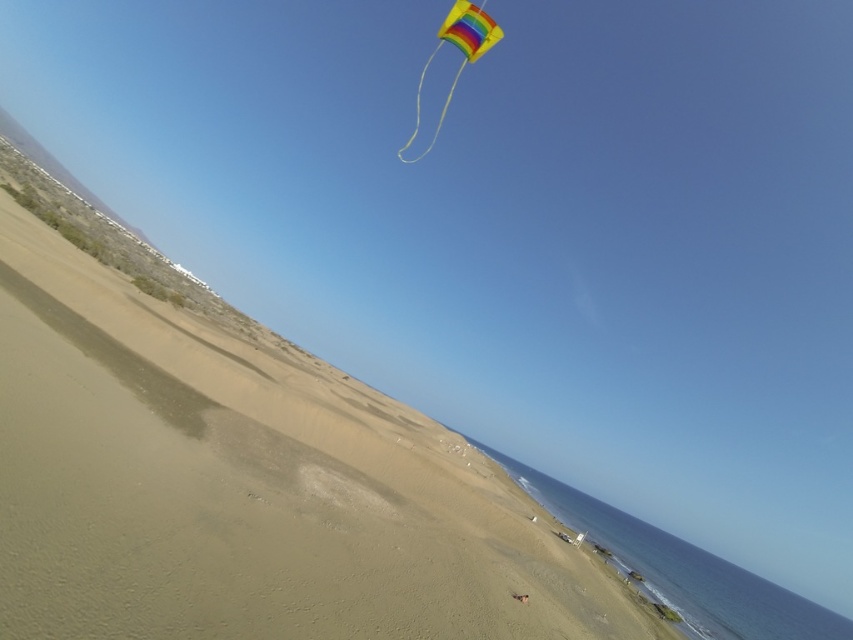
Question: Among these points, which one is nearest to the camera?

Choices:
 (A) (451, 17)
 (B) (560, 573)

Answer: (A)

Question: Which point is farther from the camera taking this photo?

Choices:
 (A) [546, 547]
 (B) [398, 150]

Answer: (B)

Question: Does smooth sand at center appear on the left side of rainbow fabric kite at upper center?

Choices:
 (A) no
 (B) yes

Answer: (B)

Question: Does smooth sand at center appear on the right side of rainbow fabric kite at upper center?

Choices:
 (A) yes
 (B) no

Answer: (B)

Question: Can you confirm if smooth sand at center is bigger than rainbow fabric kite at upper center?

Choices:
 (A) yes
 (B) no

Answer: (B)